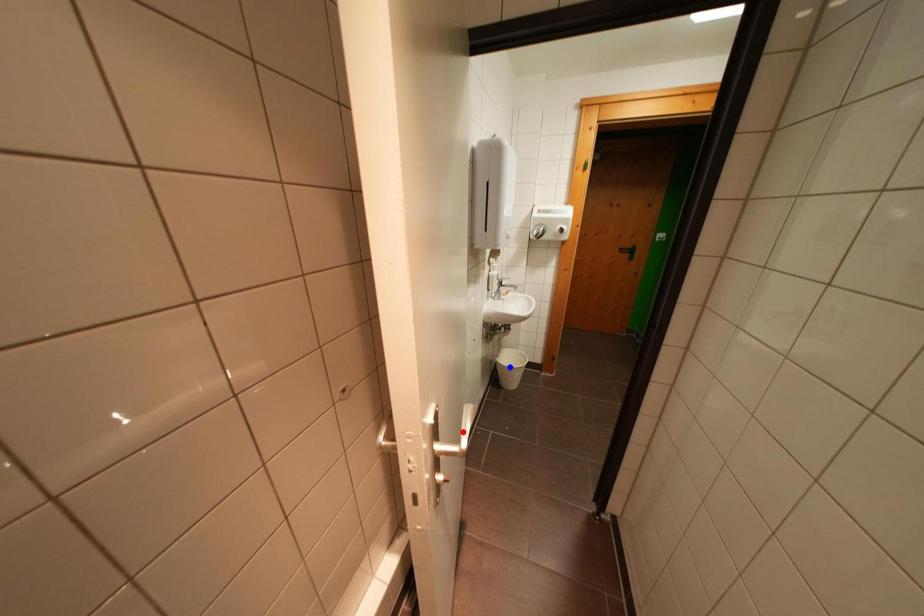
Question: Two points are marked on the image. Which point is closer to the camera?

Choices:
 (A) Blue point is closer.
 (B) Red point is closer.

Answer: (B)